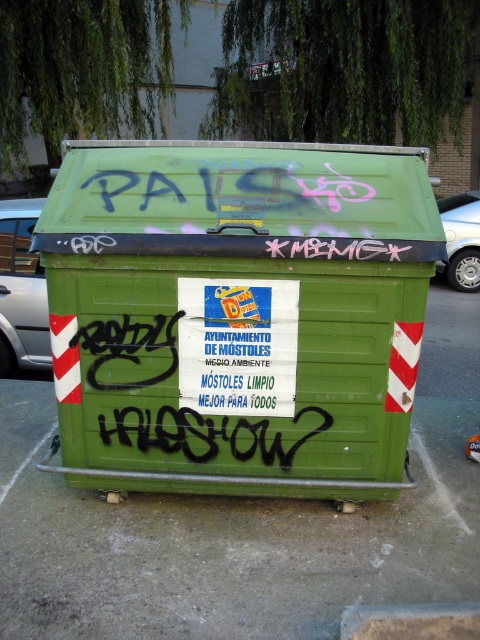
Question: Can you confirm if green matte recycling bin at center is positioned to the right of silver metallic car at right?

Choices:
 (A) yes
 (B) no

Answer: (B)

Question: Considering the real-world distances, which object is farthest from the green matte recycling bin at center?

Choices:
 (A) silver metallic car at right
 (B) silver metallic car at left

Answer: (A)

Question: Considering the relative positions of green matte recycling bin at center and silver metallic car at left in the image provided, where is green matte recycling bin at center located with respect to silver metallic car at left?

Choices:
 (A) above
 (B) below

Answer: (B)

Question: Which of the following is the closest to the observer?

Choices:
 (A) silver metallic car at left
 (B) silver metallic car at right

Answer: (A)

Question: Which of the following is the closest to the observer?

Choices:
 (A) green matte recycling bin at center
 (B) silver metallic car at left

Answer: (A)

Question: Does silver metallic car at left appear over silver metallic car at right?

Choices:
 (A) no
 (B) yes

Answer: (A)